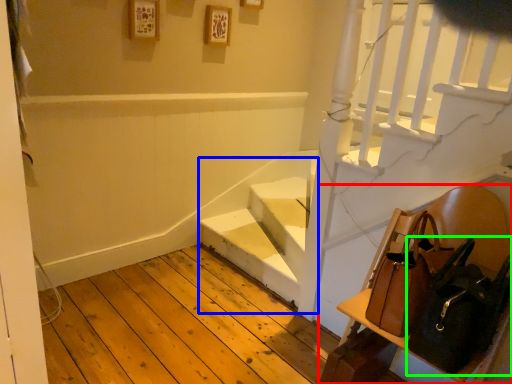
Question: Estimate the real-world distances between objects in this image. Which object is farther from furniture (highlighted by a red box), stairwell (highlighted by a blue box) or shoulder bag (highlighted by a green box)?

Choices:
 (A) stairwell
 (B) shoulder bag

Answer: (A)